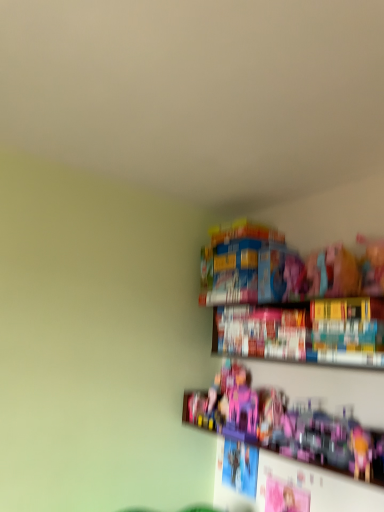
Question: Is pink plastic castle at center, acting as the first toy starting from the left, surrounded by hardcover book at upper right?

Choices:
 (A) yes
 (B) no

Answer: (B)

Question: Does hardcover book at upper right have a larger size compared to pink plastic castle at center, acting as the first toy starting from the left?

Choices:
 (A) no
 (B) yes

Answer: (B)

Question: Is hardcover book at upper right with pink plastic castle at center, acting as the first toy starting from the left?

Choices:
 (A) no
 (B) yes

Answer: (A)

Question: Does hardcover book at upper right appear on the right side of pink plastic castle at center, which is the 2th toy from right to left?

Choices:
 (A) yes
 (B) no

Answer: (A)

Question: Can you confirm if hardcover book at upper right is taller than pink plastic castle at center, which is the 2th toy from right to left?

Choices:
 (A) no
 (B) yes

Answer: (B)

Question: From a real-world perspective, relative to pink plastic toy at lower right, arranged as the second toy when viewed from the left, is hardcover book at upper right vertically above or below?

Choices:
 (A) below
 (B) above

Answer: (B)

Question: Considering the positions of point (294, 351) and point (230, 415), is point (294, 351) closer or farther from the camera than point (230, 415)?

Choices:
 (A) closer
 (B) farther

Answer: (A)

Question: Is hardcover book at upper right to the left or to the right of pink plastic toy at lower right, arranged as the second toy when viewed from the left, in the image?

Choices:
 (A) left
 (B) right

Answer: (B)

Question: Is hardcover book at upper right wider or thinner than pink plastic toy at lower right, placed as the 1th toy when sorted from right to left?

Choices:
 (A) wide
 (B) thin

Answer: (B)

Question: From their relative heights in the image, would you say pink plastic toy at lower right, placed as the 1th toy when sorted from right to left, is taller or shorter than hardcover book at upper right?

Choices:
 (A) short
 (B) tall

Answer: (A)

Question: From the image's perspective, is pink plastic toy at lower right, placed as the 1th toy when sorted from right to left, positioned above or below hardcover book at upper right?

Choices:
 (A) below
 (B) above

Answer: (A)

Question: Is pink plastic toy at lower right, arranged as the second toy when viewed from the left, situated inside hardcover book at upper right or outside?

Choices:
 (A) outside
 (B) inside

Answer: (A)

Question: Looking at their shapes, would you say pink plastic toy at lower right, arranged as the second toy when viewed from the left, is wider or thinner than hardcover book at upper right?

Choices:
 (A) thin
 (B) wide

Answer: (B)

Question: In terms of height, does pink plastic castle at center, acting as the first toy starting from the left, look taller or shorter compared to hardcover book at upper right?

Choices:
 (A) tall
 (B) short

Answer: (B)

Question: Is pink plastic castle at center, which is the 2th toy from right to left, to the left or to the right of hardcover book at upper right in the image?

Choices:
 (A) left
 (B) right

Answer: (A)